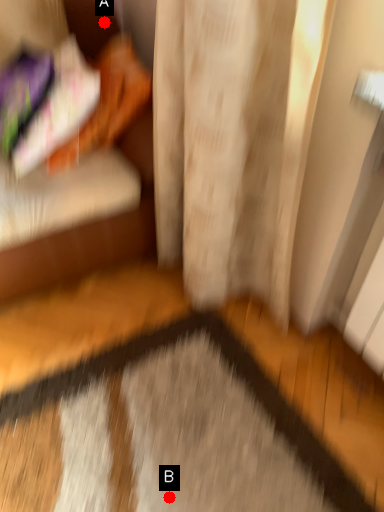
Question: Two points are circled on the image, labeled by A and B beside each circle. Which point appears closest to the camera in this image?

Choices:
 (A) A is closer
 (B) B is closer

Answer: (B)